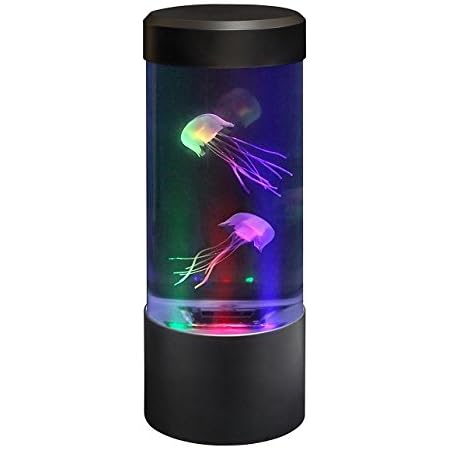
Locate an element on the screen. light purple light is located at coordinates (225, 324).